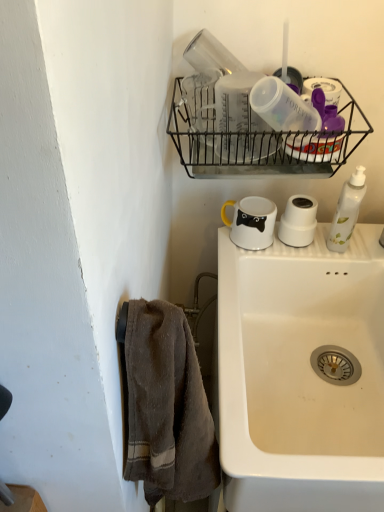
Question: Is black wire basket at upper center closer to the viewer compared to white ceramic sink at lower right?

Choices:
 (A) no
 (B) yes

Answer: (A)

Question: Is black wire basket at upper center shorter than white ceramic sink at lower right?

Choices:
 (A) yes
 (B) no

Answer: (A)

Question: Is the depth of black wire basket at upper center greater than that of white ceramic sink at lower right?

Choices:
 (A) yes
 (B) no

Answer: (A)

Question: Is black wire basket at upper center taller than white ceramic sink at lower right?

Choices:
 (A) yes
 (B) no

Answer: (B)

Question: Can you confirm if black wire basket at upper center is wider than white ceramic sink at lower right?

Choices:
 (A) yes
 (B) no

Answer: (B)

Question: Is black wire basket at upper center turned away from white ceramic sink at lower right?

Choices:
 (A) yes
 (B) no

Answer: (B)

Question: Does brown textured towel at left have a lesser width compared to black wire basket at upper center?

Choices:
 (A) no
 (B) yes

Answer: (B)

Question: Is brown textured towel at left next to black wire basket at upper center?

Choices:
 (A) no
 (B) yes

Answer: (A)

Question: Can you confirm if brown textured towel at left is smaller than black wire basket at upper center?

Choices:
 (A) no
 (B) yes

Answer: (B)

Question: From a real-world perspective, is brown textured towel at left located higher than black wire basket at upper center?

Choices:
 (A) no
 (B) yes

Answer: (A)

Question: Is the position of brown textured towel at left more distant than that of black wire basket at upper center?

Choices:
 (A) no
 (B) yes

Answer: (A)

Question: Does brown textured towel at left have a lesser height compared to black wire basket at upper center?

Choices:
 (A) yes
 (B) no

Answer: (B)

Question: Does white glossy mug at upper center come in front of white ceramic sink at lower right?

Choices:
 (A) yes
 (B) no

Answer: (B)